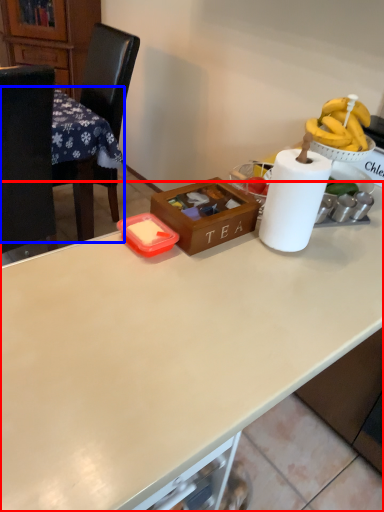
Question: Among these objects, which one is farthest to the camera, desk (highlighted by a red box) or table (highlighted by a blue box)?

Choices:
 (A) desk
 (B) table

Answer: (B)